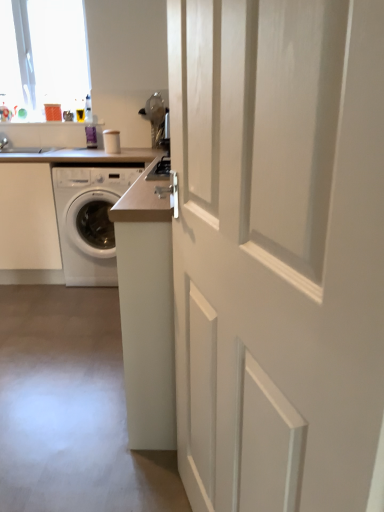
Question: Considering their positions, is white glossy washing machine at left located in front of or behind transparent glass window at upper left?

Choices:
 (A) behind
 (B) front

Answer: (B)

Question: Considering the positions of white glossy washing machine at left and transparent glass window at upper left in the image, is white glossy washing machine at left taller or shorter than transparent glass window at upper left?

Choices:
 (A) short
 (B) tall

Answer: (A)

Question: Which object is the farthest from the white glossy washing machine at left?

Choices:
 (A) transparent glass window at upper left
 (B) white glossy door at center
 (C) white laminate counter at center
 (D) white glossy washing machine at left

Answer: (B)

Question: Which object is positioned farthest from the transparent glass window at upper left?

Choices:
 (A) white glossy door at center
 (B) white laminate counter at center
 (C) white glossy washing machine at left
 (D) white glossy washing machine at left

Answer: (A)